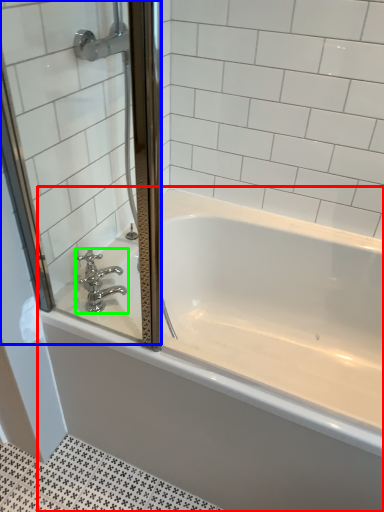
Question: Based on their relative distances, which object is farther from bathtub (highlighted by a red box)? Choose from screen door (highlighted by a blue box) and tap (highlighted by a green box).

Choices:
 (A) screen door
 (B) tap

Answer: (B)